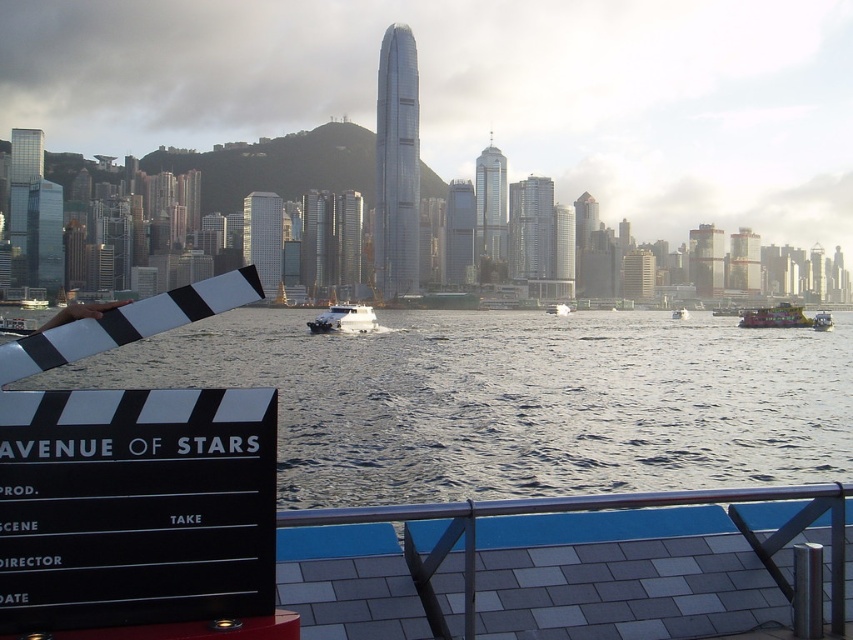
You are a film director observing the scene from the ferry. You notice the metallic green boat at center and the metallic silver boat at center. Which boat is positioned lower in the frame?

The metallic green boat at center is positioned below the metallic silver boat at center, so it is lower in the frame.

You are a photographer on a ferry and want to capture the white glossy boat at center in your shot. However, the clear water at center is blocking your view. Can you adjust your position to see the boat without the water obstructing it?

The clear water at center is closer to the viewer than the white glossy boat at center, so you cannot see the boat without moving closer or adjusting your angle to avoid the water.